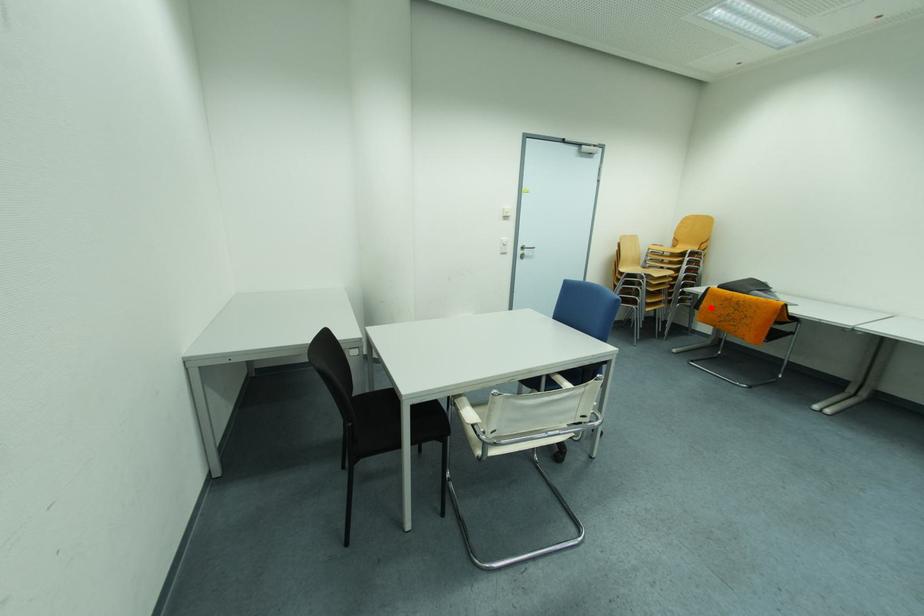
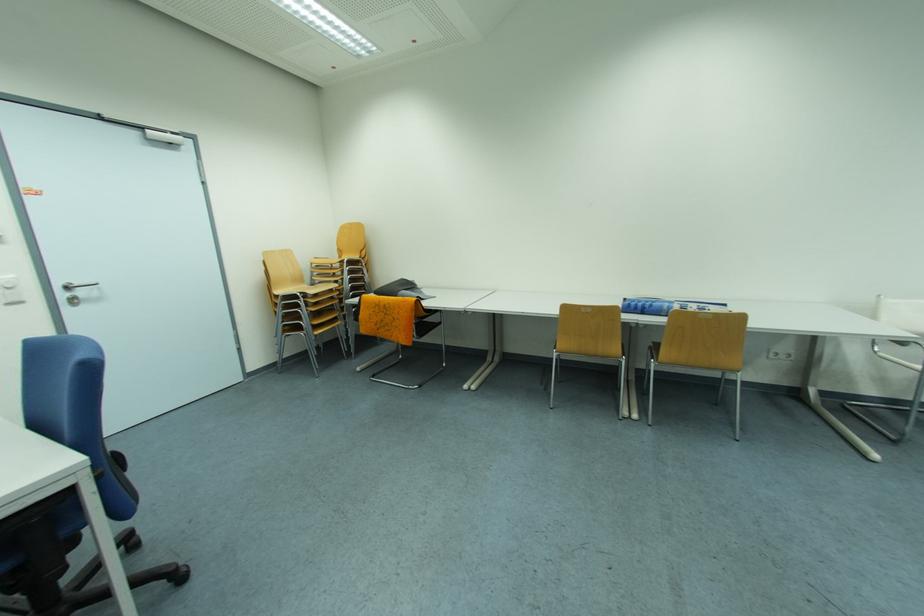
Question: I am providing you with two images of the same scene from different viewpoints. In image1, a red point is highlighted. Considering the same 3D point in image2, which of the following is correct?

Choices:
 (A) It is closer
 (B) It is farther

Answer: (B)